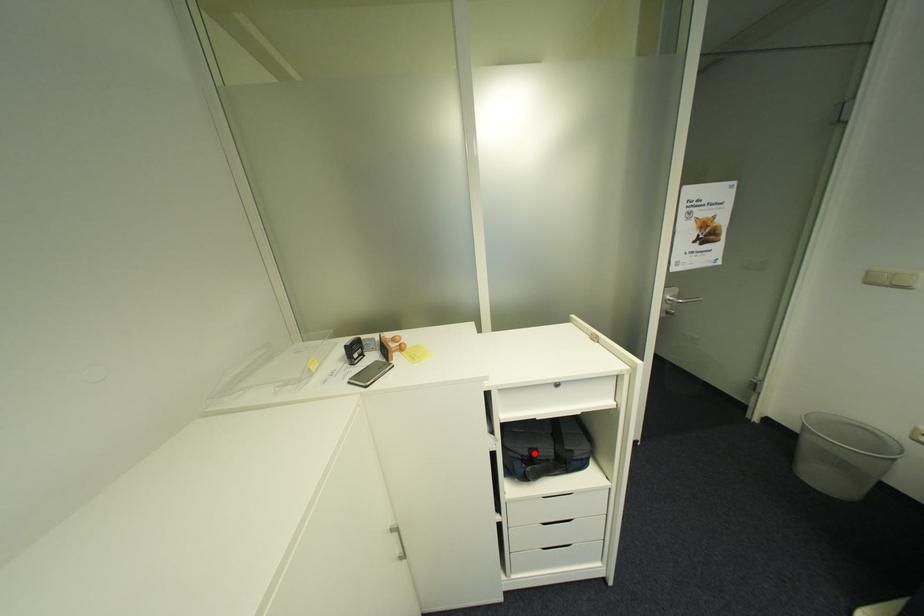
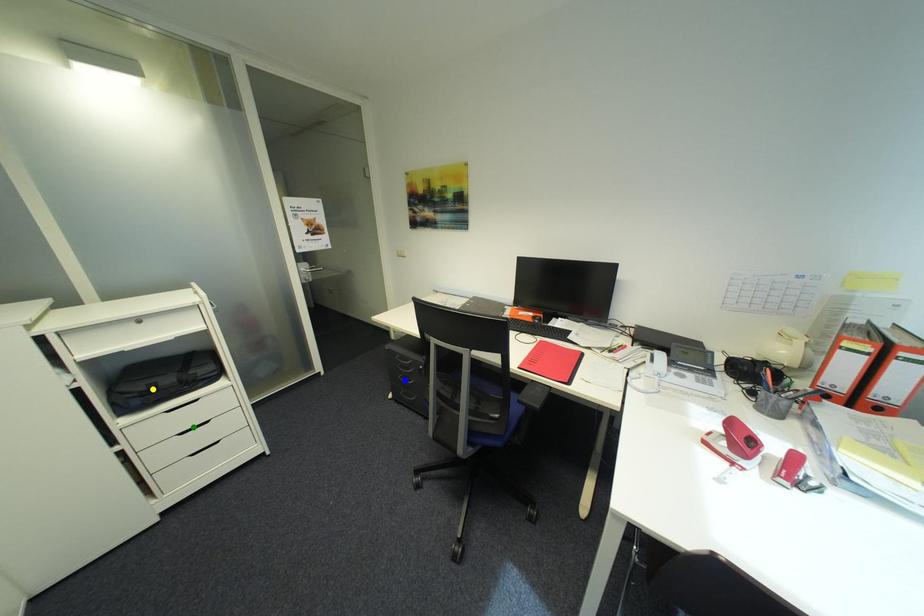
Question: I am providing you with two images of the same scene from different viewpoints. A red point is marked on the first image. You are given multiple points on the second image. Which point in image 2 is actually the same real-world point as the red point in image 1?

Choices:
 (A) yellow point
 (B) blue point
 (C) green point

Answer: (A)